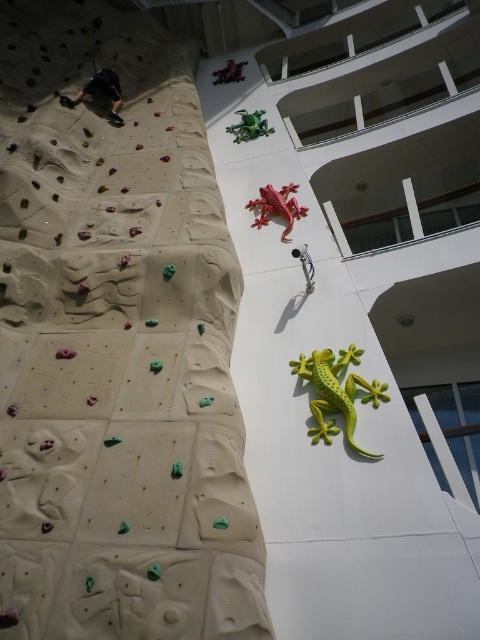
You are standing in front of the climbing wall and want to reach the point at the top of the wall. You see two points marked on the wall, point [372,381] and point [283,198]. Which point is closer to you?

Point [372,381] is in front of point [283,198], so it is closer to you.